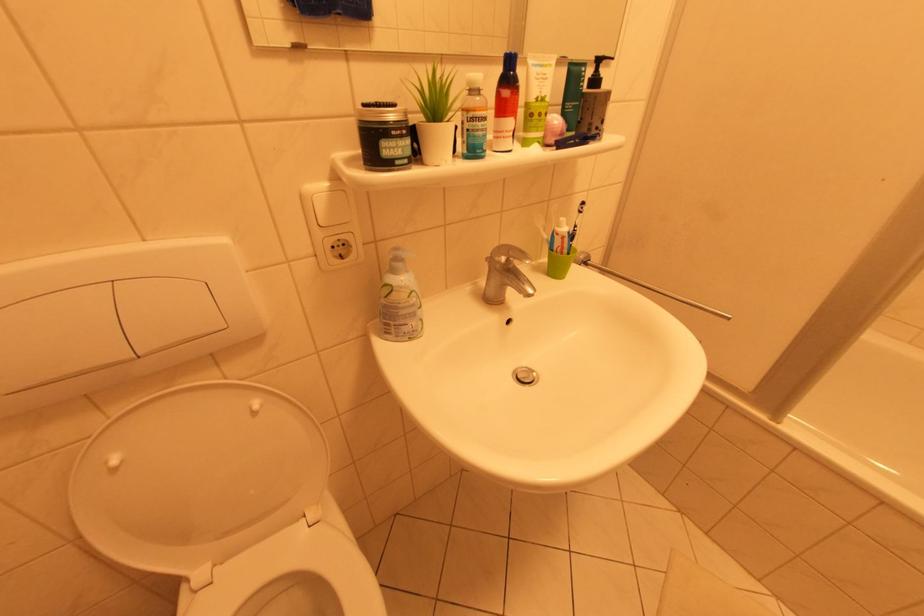
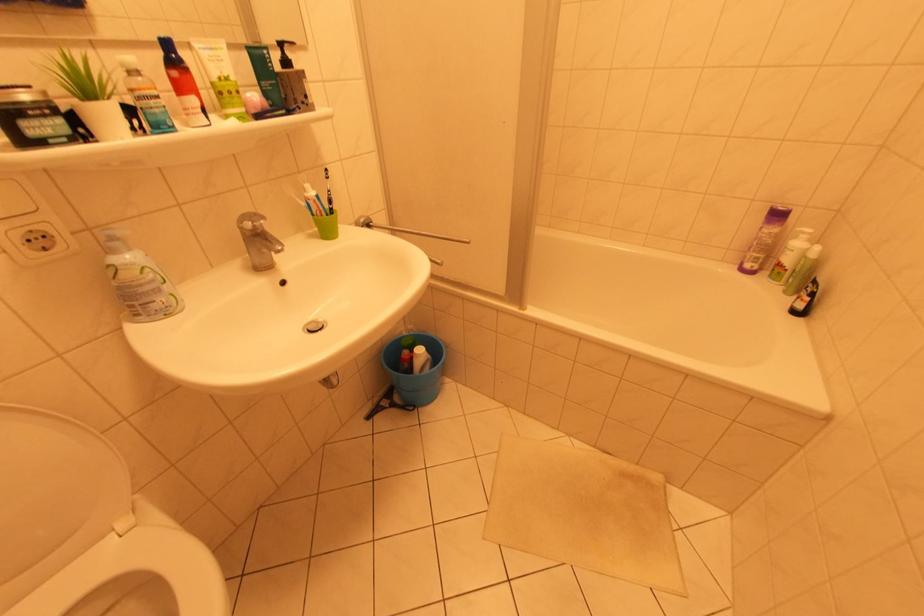
What movement of the cameraman would produce the second image?

The movement direction of the cameraman is right, backward.